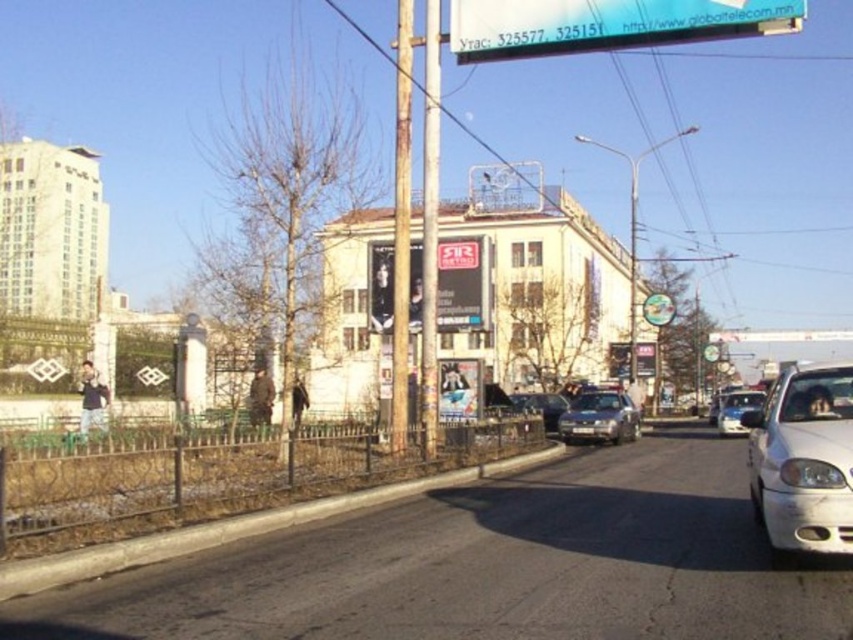
You are a pedestrian crossing the street and notice a transparent plastic sign at upper center and a metallic silver sedan at center. Which object is closer to you?

The transparent plastic sign at upper center is closer to you since it is in front of the metallic silver sedan at center.